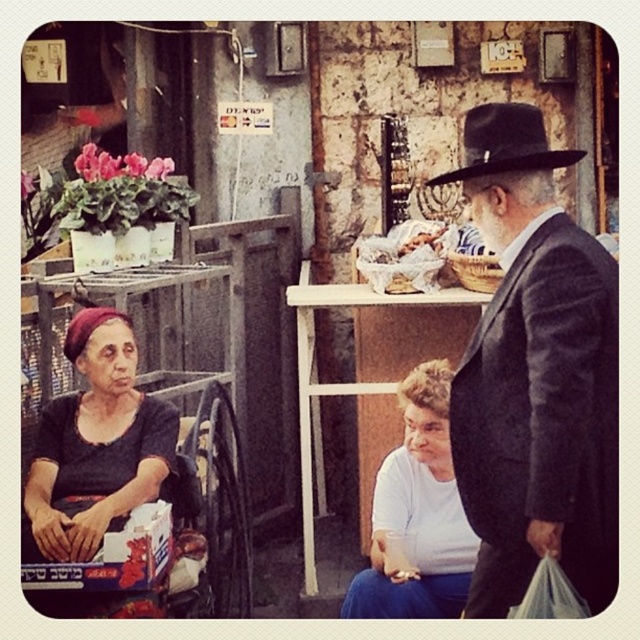
You are a delivery person trying to locate a specific delivery point marked at coordinates point (97, 442). You see the dark gray fabric headscarf at lower left. Is the delivery point located above or below the dark gray fabric headscarf at lower left?

The delivery point at point (97, 442) is located below the dark gray fabric headscarf at lower left.

You are a delivery person who needs to place a small package between the white matte shirt at lower center and the black felt fedora at center. Can you fit the package in the space between them if the package is 1.4 meters long?

The distance between the white matte shirt at lower center and the black felt fedora at center is 1.50 meters. Since the package is 1.4 meters long, it can fit in the space between them.